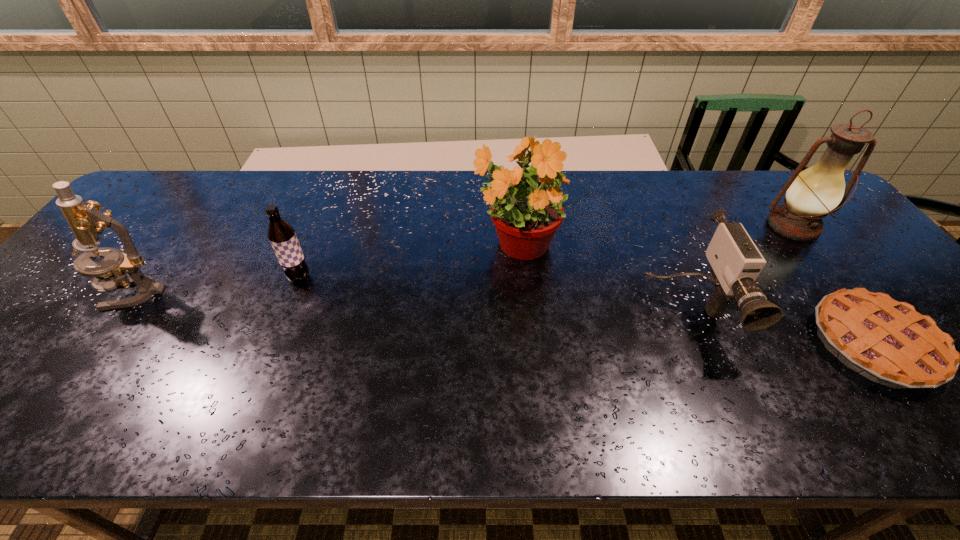
You are a GUI agent. You are given a task and a screenshot of the screen. Output one action in this format:
    pyautogui.click(x=<x>, y=<y>)
    Task: Click on the oil lamp
    
    Given the screenshot: What is the action you would take?
    pyautogui.click(x=811, y=194)

You are a GUI agent. You are given a task and a screenshot of the screen. Output one action in this format:
    pyautogui.click(x=<x>, y=<y>)
    Task: Click on the fourth object from right to left
    The height and width of the screenshot is (540, 960).
    Given the screenshot: What is the action you would take?
    pos(526,200)

Where is `the leftmost object`? Image resolution: width=960 pixels, height=540 pixels. the leftmost object is located at coordinates click(x=86, y=221).

I want to click on the second object from left to right, so click(282, 236).

Image resolution: width=960 pixels, height=540 pixels. In order to click on camcorder in this screenshot , I will do `click(735, 262)`.

Find the location of a particular element. The height and width of the screenshot is (540, 960). free location located 0.060m on the right of the oil lamp is located at coordinates [848, 227].

This screenshot has height=540, width=960. What are the coordinates of `free location located 0.370m on the left of the fourth object from right to left` in the screenshot? It's located at (338, 246).

Locate an element on the screen. This screenshot has width=960, height=540. free space located on the left of the leftmost object is located at coordinates (67, 292).

The image size is (960, 540). I want to click on blank space located 0.090m on the left of the root beer, so click(x=252, y=277).

Where is `vacant space located 0.070m on the recording direction of the camcorder`? This screenshot has height=540, width=960. vacant space located 0.070m on the recording direction of the camcorder is located at coordinates (718, 388).